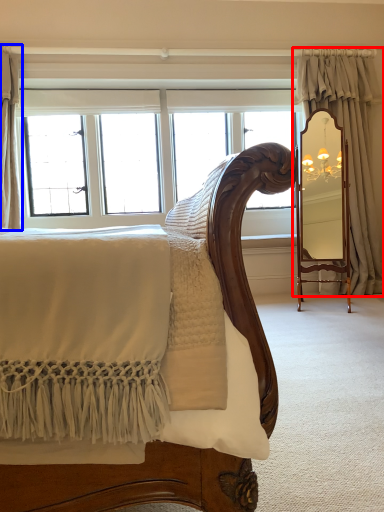
Question: Which point is closer to the camera, curtain (highlighted by a red box) or curtain (highlighted by a blue box)?

Choices:
 (A) curtain
 (B) curtain

Answer: (B)